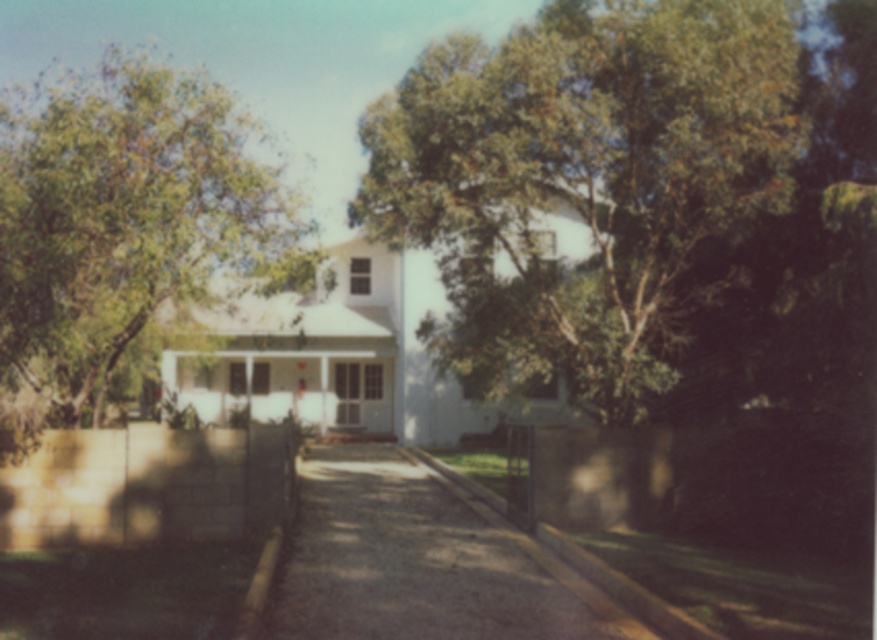
Consider the image. Does green leafy tree at upper left appear over gravelly asphalt driveway at center?

Yes, green leafy tree at upper left is above gravelly asphalt driveway at center.

Is point (12, 365) farther from camera compared to point (498, 612)?

That is True.

I want to click on green leafy tree at upper left, so click(127, 225).

Is point (478, 83) positioned behind point (428, 586)?

Yes, it is behind point (428, 586).

Is green leafy tree at upper center further to camera compared to gravelly asphalt driveway at center?

Yes.

The width and height of the screenshot is (877, 640). Find the location of `green leafy tree at upper center`. green leafy tree at upper center is located at coordinates (583, 180).

Is green leafy tree at upper center to the right of green leafy tree at upper left from the viewer's perspective?

Correct, you'll find green leafy tree at upper center to the right of green leafy tree at upper left.

Between point (465, 164) and point (39, 209), which one is positioned in front?

Positioned in front is point (39, 209).

Who is more distant from viewer, (382, 221) or (43, 298)?

Positioned behind is point (382, 221).

The image size is (877, 640). Identify the location of green leafy tree at upper center. (583, 180).